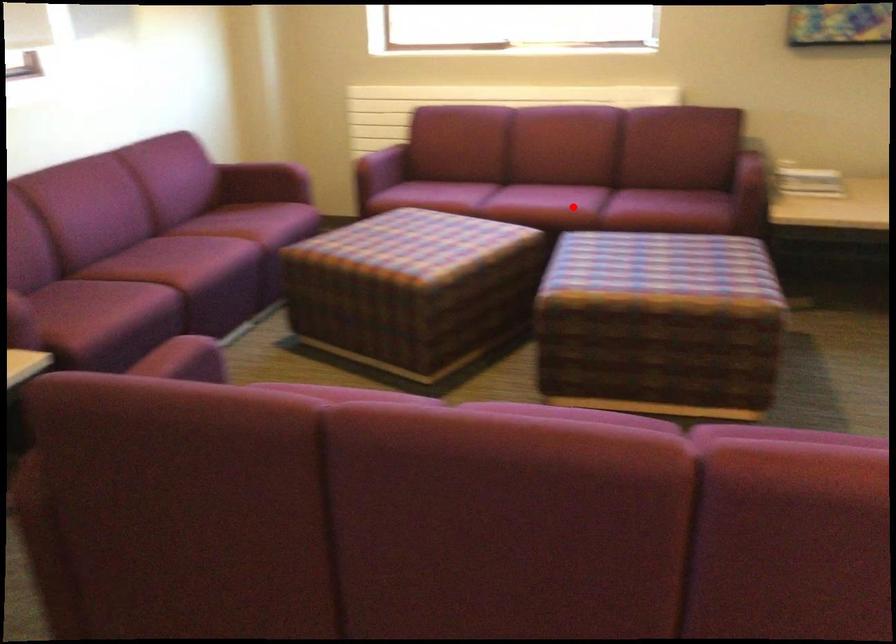
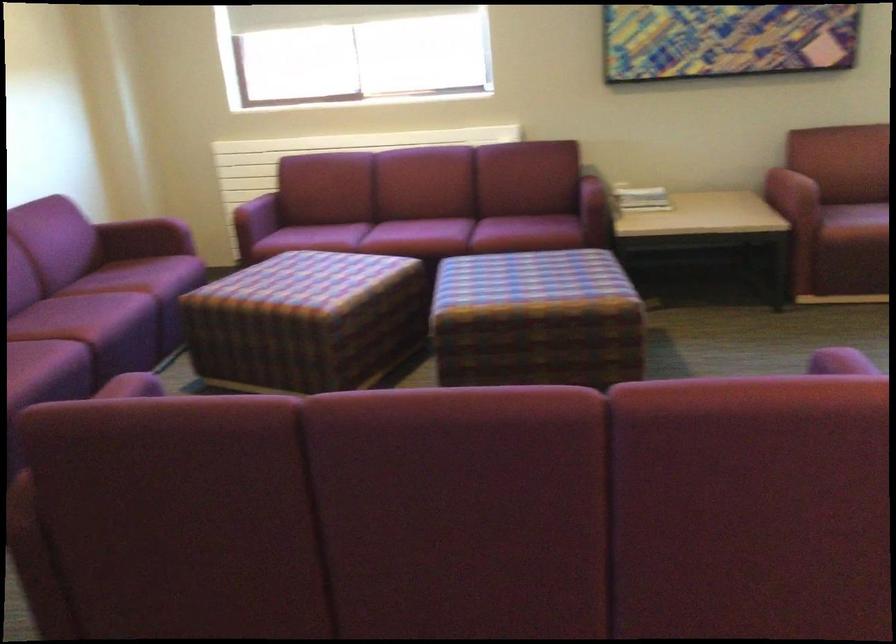
Question: I am providing you with two images of the same scene from different viewpoints. In image1, a red point is highlighted. Considering the same 3D point in image2, which of the following is correct?

Choices:
 (A) It is closer
 (B) It is farther

Answer: (B)